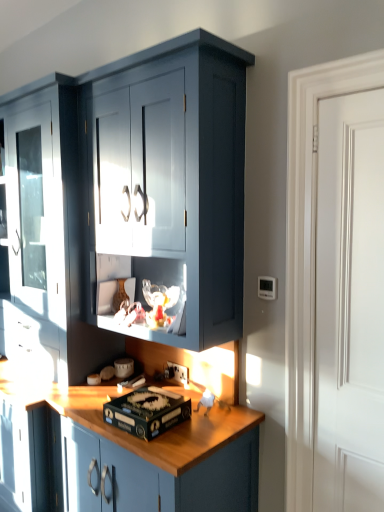
Question: From the image's perspective, is white smooth door at right beneath matte dark blue cabinet at center?

Choices:
 (A) yes
 (B) no

Answer: (B)

Question: Considering the relative sizes of white smooth door at right and matte dark blue cabinet at center in the image provided, is white smooth door at right taller than matte dark blue cabinet at center?

Choices:
 (A) yes
 (B) no

Answer: (B)

Question: Is white smooth door at right far away from matte dark blue cabinet at center?

Choices:
 (A) no
 (B) yes

Answer: (A)

Question: Does white smooth door at right have a smaller size compared to matte dark blue cabinet at center?

Choices:
 (A) no
 (B) yes

Answer: (B)

Question: Is white smooth door at right at the right side of matte dark blue cabinet at center?

Choices:
 (A) no
 (B) yes

Answer: (B)

Question: Is white plastic electric outlet at lower center taller or shorter than matte dark blue cabinet at center?

Choices:
 (A) tall
 (B) short

Answer: (B)

Question: In the image, is white plastic electric outlet at lower center positioned in front of or behind matte dark blue cabinet at center?

Choices:
 (A) behind
 (B) front

Answer: (A)

Question: Is white plastic electric outlet at lower center to the left or to the right of matte dark blue cabinet at center in the image?

Choices:
 (A) right
 (B) left

Answer: (A)

Question: In terms of width, does white plastic electric outlet at lower center look wider or thinner when compared to matte dark blue cabinet at center?

Choices:
 (A) thin
 (B) wide

Answer: (A)

Question: In terms of width, does matte dark blue cabinet at center look wider or thinner when compared to black cardboard box at center?

Choices:
 (A) thin
 (B) wide

Answer: (B)

Question: From their relative heights in the image, would you say matte dark blue cabinet at center is taller or shorter than black cardboard box at center?

Choices:
 (A) tall
 (B) short

Answer: (A)

Question: Considering their positions, is matte dark blue cabinet at center located in front of or behind black cardboard box at center?

Choices:
 (A) front
 (B) behind

Answer: (A)

Question: From a real-world perspective, is matte dark blue cabinet at center physically located above or below black cardboard box at center?

Choices:
 (A) above
 (B) below

Answer: (A)

Question: In the image, is matte dark blue cabinet at center on the left side or the right side of white plastic electric outlet at lower center?

Choices:
 (A) right
 (B) left

Answer: (B)

Question: Does point (28, 270) appear closer or farther from the camera than point (182, 369)?

Choices:
 (A) farther
 (B) closer

Answer: (A)